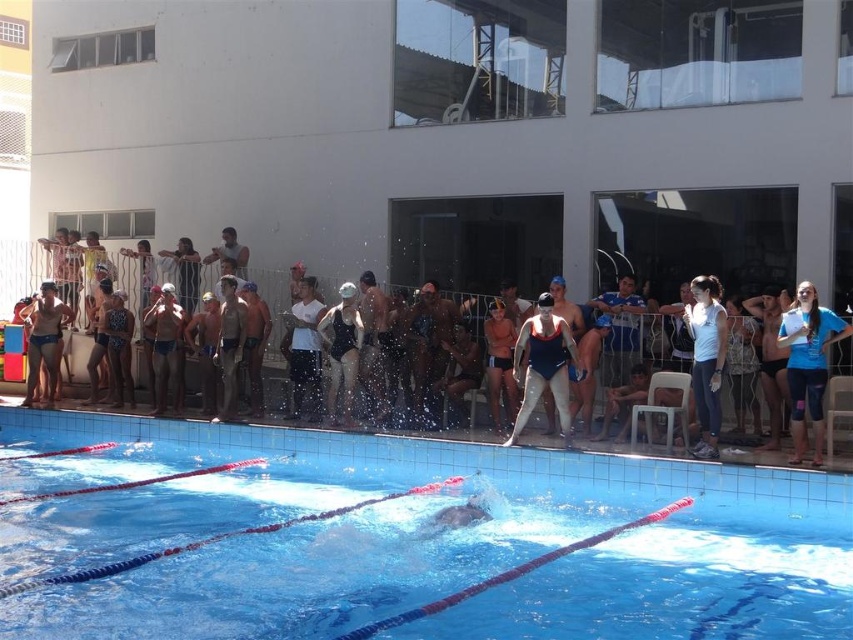
Based on the photo, which of these two, blue smooth water at center or white matte swimsuit at center, stands taller?

With more height is white matte swimsuit at center.

Between blue smooth water at center and white matte swimsuit at center, which one appears on the right side from the viewer's perspective?

Positioned to the right is white matte swimsuit at center.

Find the location of a particular element. The height and width of the screenshot is (640, 853). blue smooth water at center is located at coordinates point(407,538).

Does blue smooth water at center appear over blue fabric swimsuit at upper right?

No, blue smooth water at center is not above blue fabric swimsuit at upper right.

Which of these two, blue smooth water at center or blue fabric swimsuit at upper right, stands taller?

blue fabric swimsuit at upper right is taller.

Find the location of a particular element. blue smooth water at center is located at coordinates (407, 538).

Does point (705, 394) come behind point (344, 307)?

That is False.

What are the coordinates of `white matte swimsuit at center` in the screenshot? It's located at (706, 358).